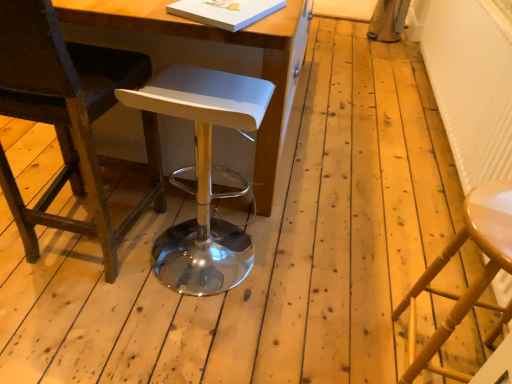
Find the location of a particular element. This screenshot has height=384, width=512. vacant region under wooden chair at right, the first stool when ordered from right to left (from a real-world perspective) is located at coordinates (429, 362).